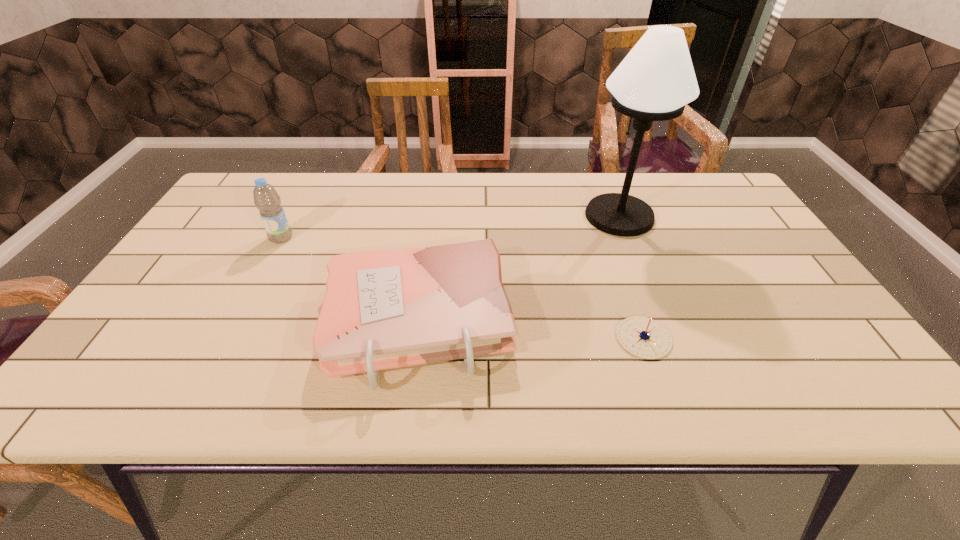
Locate an element on the screen. This screenshot has width=960, height=540. the tallest object is located at coordinates (654, 82).

The width and height of the screenshot is (960, 540). Identify the location of the leftmost object. (266, 199).

Image resolution: width=960 pixels, height=540 pixels. Find the location of `the second tallest object`. the second tallest object is located at coordinates pos(266,199).

Find the location of a particular element. This screenshot has width=960, height=540. the second shortest object is located at coordinates (384, 309).

You are a GUI agent. You are given a task and a screenshot of the screen. Output one action in this format:
    pyautogui.click(x=<x>, y=<y>)
    Task: Click on the third object from right to left
    The width and height of the screenshot is (960, 540).
    Given the screenshot: What is the action you would take?
    pyautogui.click(x=384, y=309)

Where is `compass`? Image resolution: width=960 pixels, height=540 pixels. compass is located at coordinates (643, 337).

This screenshot has height=540, width=960. I want to click on vacant area situated 0.350m on the front of the tallest object, so click(667, 338).

This screenshot has height=540, width=960. In order to click on vacant space situated on the front of the water bottle in this screenshot , I will do `click(270, 260)`.

Where is `vacant space located on the back of the third tallest object`? The width and height of the screenshot is (960, 540). vacant space located on the back of the third tallest object is located at coordinates (436, 192).

You are a GUI agent. You are given a task and a screenshot of the screen. Output one action in this format:
    pyautogui.click(x=<x>, y=<y>)
    Task: Click on the blank area located on the left of the shortest object
    Image resolution: width=960 pixels, height=540 pixels.
    Given the screenshot: What is the action you would take?
    pyautogui.click(x=585, y=338)